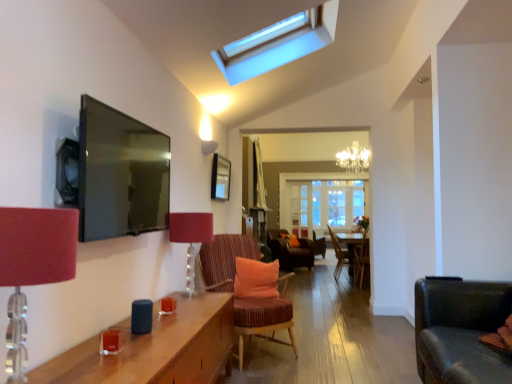
Question: From a real-world perspective, is wooden picture frame at center positioned under wooden chair at center, acting as the third chair starting from the back, based on gravity?

Choices:
 (A) no
 (B) yes

Answer: (A)

Question: Would you say wooden picture frame at center contains wooden chair at center, the second chair in the front-to-back sequence?

Choices:
 (A) no
 (B) yes

Answer: (A)

Question: From the image's perspective, would you say wooden picture frame at center is positioned over wooden chair at center, acting as the third chair starting from the back?

Choices:
 (A) no
 (B) yes

Answer: (B)

Question: Is wooden picture frame at center with wooden chair at center, acting as the third chair starting from the back?

Choices:
 (A) yes
 (B) no

Answer: (B)

Question: Is wooden picture frame at center taller than wooden chair at center, acting as the third chair starting from the back?

Choices:
 (A) yes
 (B) no

Answer: (B)

Question: Considering the positions of matte red lampshade at center, the 2th table lamp viewed from the front, and velvet orange chair at center, which is the first chair in back-to-front order, in the image, is matte red lampshade at center, the 2th table lamp viewed from the front, wider or thinner than velvet orange chair at center, which is the first chair in back-to-front order,?

Choices:
 (A) wide
 (B) thin

Answer: (B)

Question: From a real-world perspective, relative to velvet orange chair at center, marked as the 4th chair in a front-to-back arrangement, is matte red lampshade at center, which is the 1th table lamp in back-to-front order, vertically above or below?

Choices:
 (A) below
 (B) above

Answer: (B)

Question: Considering their positions, is matte red lampshade at center, which is the 1th table lamp in back-to-front order, located in front of or behind velvet orange chair at center, marked as the 4th chair in a front-to-back arrangement?

Choices:
 (A) behind
 (B) front

Answer: (B)

Question: Is matte red lampshade at center, which is the 1th table lamp in back-to-front order, bigger or smaller than velvet orange chair at center, which is the first chair in back-to-front order?

Choices:
 (A) small
 (B) big

Answer: (A)

Question: From the image's perspective, is orange fabric pillow at center located above or below wooden picture frame at center?

Choices:
 (A) below
 (B) above

Answer: (A)

Question: From a real-world perspective, is orange fabric pillow at center physically located above or below wooden picture frame at center?

Choices:
 (A) above
 (B) below

Answer: (B)

Question: Does point (250, 283) appear closer or farther from the camera than point (217, 195)?

Choices:
 (A) closer
 (B) farther

Answer: (A)

Question: In terms of size, does orange fabric pillow at center appear bigger or smaller than wooden picture frame at center?

Choices:
 (A) big
 (B) small

Answer: (A)

Question: Is transparent glass skylight at upper center in front of or behind wooden side table at center in the image?

Choices:
 (A) behind
 (B) front

Answer: (B)

Question: From the image's perspective, is transparent glass skylight at upper center above or below wooden side table at center?

Choices:
 (A) below
 (B) above

Answer: (B)